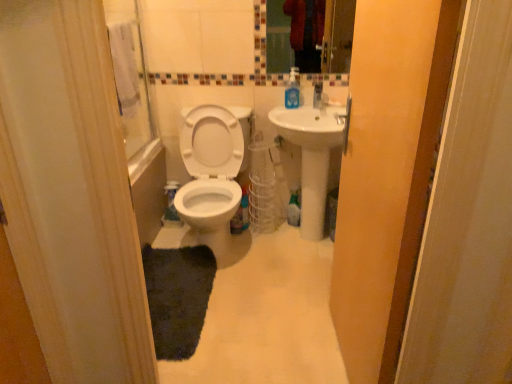
Locate an element on the screen. vacant area to the right of dark gray plush rug at center is located at coordinates (266, 297).